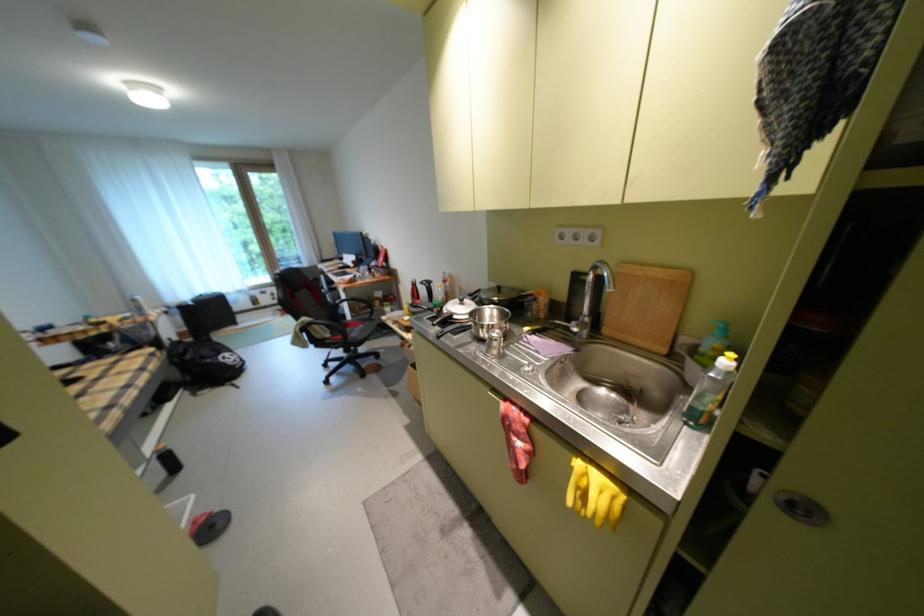
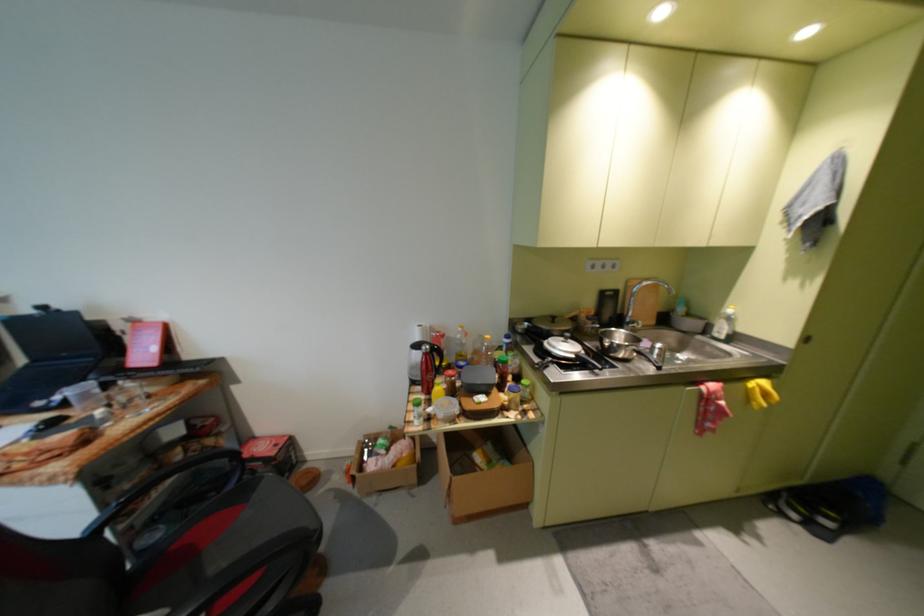
Locate, in the second image, the point that corresponds to the point at 424,288 in the first image.

(439, 358)